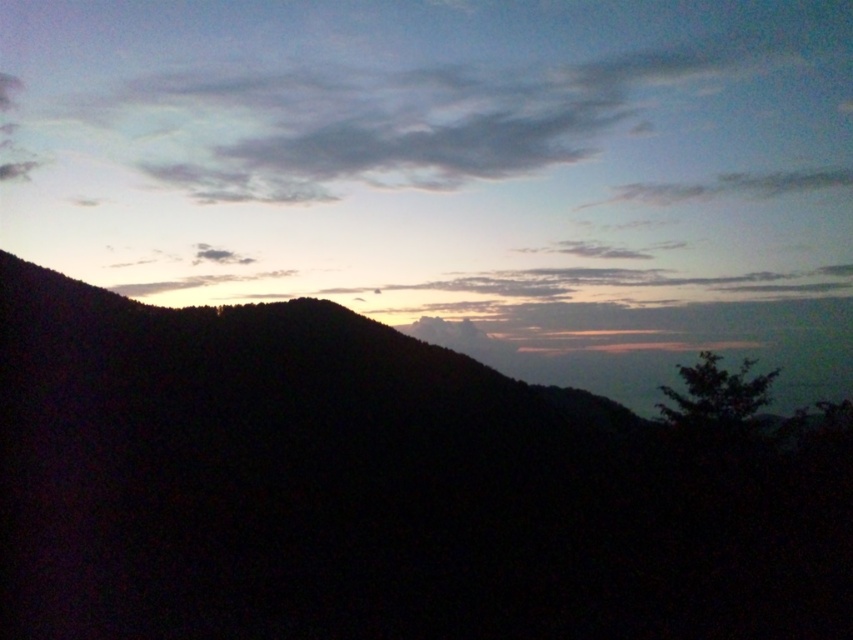
Question: Does matte orange sky at upper center appear on the left side of silhouette mountain at left?

Choices:
 (A) no
 (B) yes

Answer: (A)

Question: Does matte orange sky at upper center have a lesser width compared to silhouette mountain at left?

Choices:
 (A) yes
 (B) no

Answer: (B)

Question: Which point appears closest to the camera in this image?

Choices:
 (A) (457, 460)
 (B) (366, 292)

Answer: (A)

Question: In this image, where is matte orange sky at upper center located relative to silhouette mountain at left?

Choices:
 (A) right
 (B) left

Answer: (A)

Question: Among these points, which one is farthest from the camera?

Choices:
 (A) (706, 115)
 (B) (635, 508)

Answer: (A)